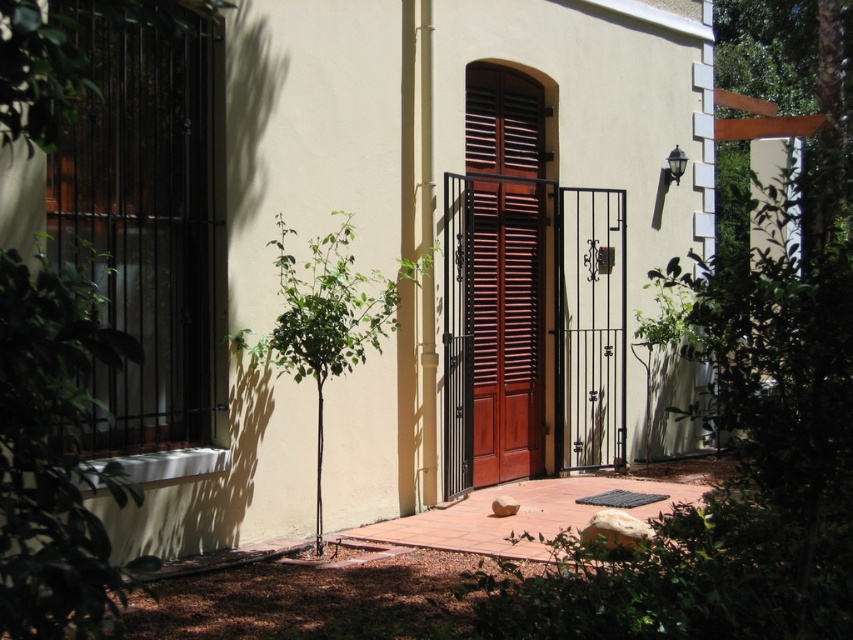
Does point (190, 108) come closer to viewer compared to point (500, 244)?

Yes, point (190, 108) is in front of point (500, 244).

The width and height of the screenshot is (853, 640). What do you see at coordinates (142, 221) in the screenshot? I see `black matte shutter at left` at bounding box center [142, 221].

Identify the location of black matte shutter at left. This screenshot has width=853, height=640. (x=142, y=221).